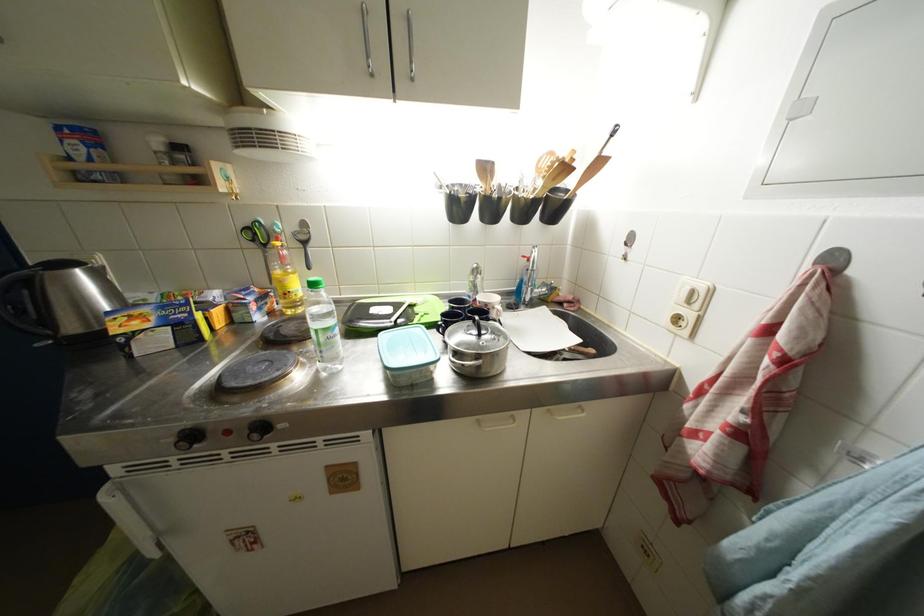
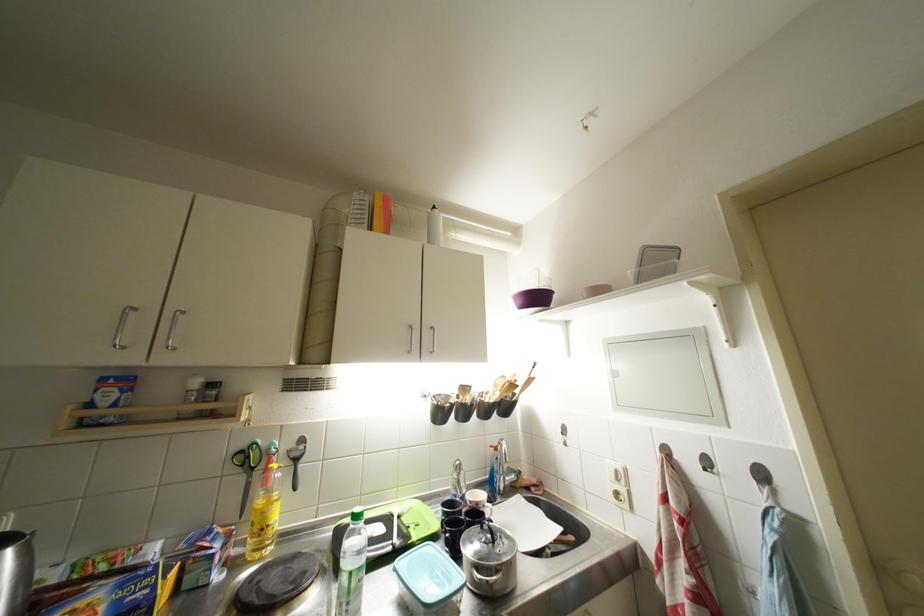
The point at [329,344] is marked in the first image. Where is the corresponding point in the second image?

(359, 589)